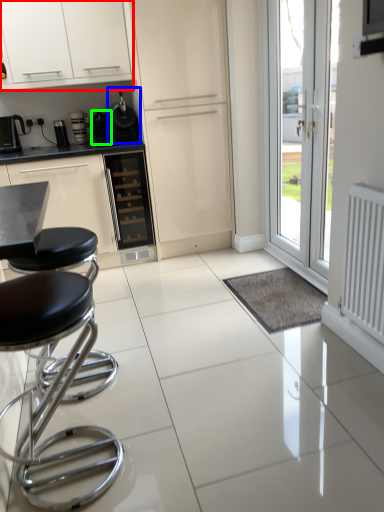
Question: Estimate the real-world distances between objects in this image. Which object is farther from cabinetry (highlighted by a red box), appliance (highlighted by a blue box) or appliance (highlighted by a green box)?

Choices:
 (A) appliance
 (B) appliance

Answer: (B)